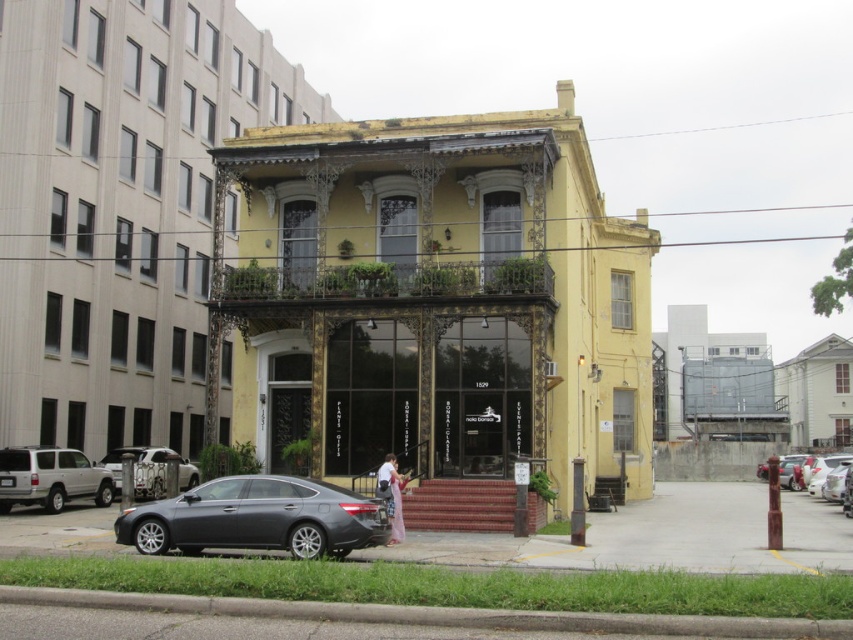
You are a delivery driver who needs to park your truck next to the building. There is a satin gray sedan at lower left and a silver metallic suv at lower left already parked. Can you determine which vehicle takes up more space in the parking area?

The silver metallic suv at lower left takes up more space in the parking area because the satin gray sedan at lower left occupies less space than it.

You are a delivery person arriving at the two story building with a package for Royal Cleaners. The entrance is behind the black metal gate. To reach the entrance, you need to walk around the building. Which side of the satin gray sedan at lower left should you go around to get to the entrance?

The satin gray sedan at lower left is located at point (257, 518). Since the entrance is behind the black metal gate which is at the lower level of the building, you should go around the right side of the satin gray sedan at lower left to reach the entrance.

Based on the photo, you are standing in front of the two story building and want to take a photo. You notice two points marked on the building. The first point is at coordinate point (33, 481) and the second is at point (131, 452). Which point will appear closer to the camera in your photo?

Point (33, 481) is closer to the camera than point (131, 452), so it will appear closer in the photo.